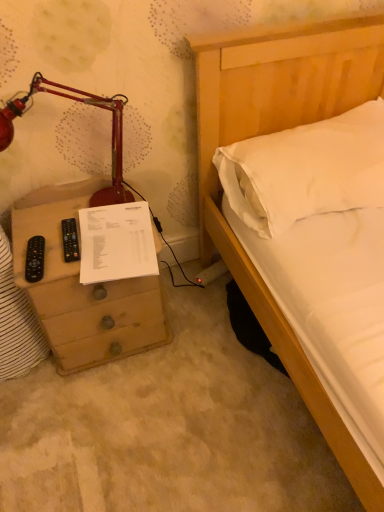
Locate an element on the screen. The width and height of the screenshot is (384, 512). free space to the right of wooden chest of drawers at left is located at coordinates (197, 330).